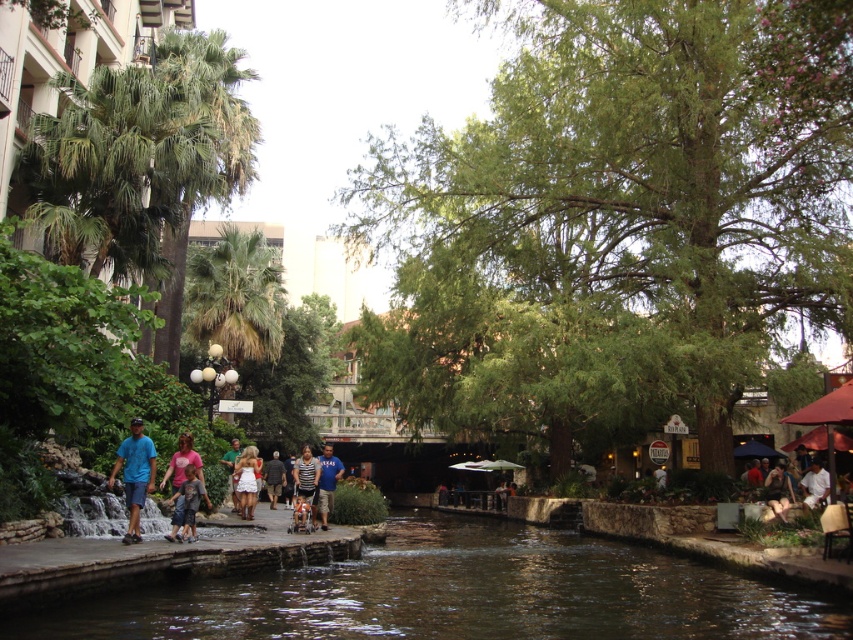
Looking at this image, who is positioned more to the right, brown stone river at lower center or green fabric shirt at center?

brown stone river at lower center

Can you confirm if brown stone river at lower center is taller than green fabric shirt at center?

Yes.

Does point (51, 611) come farther from viewer compared to point (235, 440)?

That is False.

This screenshot has height=640, width=853. In order to click on brown stone river at lower center in this screenshot , I will do `click(460, 595)`.

Who is positioned more to the left, pink cotton shirt at center or striped fabric shirt at center?

Positioned to the left is pink cotton shirt at center.

Is pink cotton shirt at center closer to the viewer compared to striped fabric shirt at center?

That is True.

Locate an element on the screen. Image resolution: width=853 pixels, height=640 pixels. pink cotton shirt at center is located at coordinates (178, 477).

This screenshot has height=640, width=853. In order to click on pink cotton shirt at center in this screenshot , I will do `click(178, 477)`.

Which of these two, dark brown leather jacket at lower right or dark gray shirt at center, stands taller?

dark gray shirt at center is taller.

How much distance is there between dark brown leather jacket at lower right and dark gray shirt at center?

161.88 feet

Who is more distant from viewer, (776, 515) or (277, 484)?

Positioned behind is point (277, 484).

Where is `dark brown leather jacket at lower right`? This screenshot has width=853, height=640. dark brown leather jacket at lower right is located at coordinates pos(778,490).